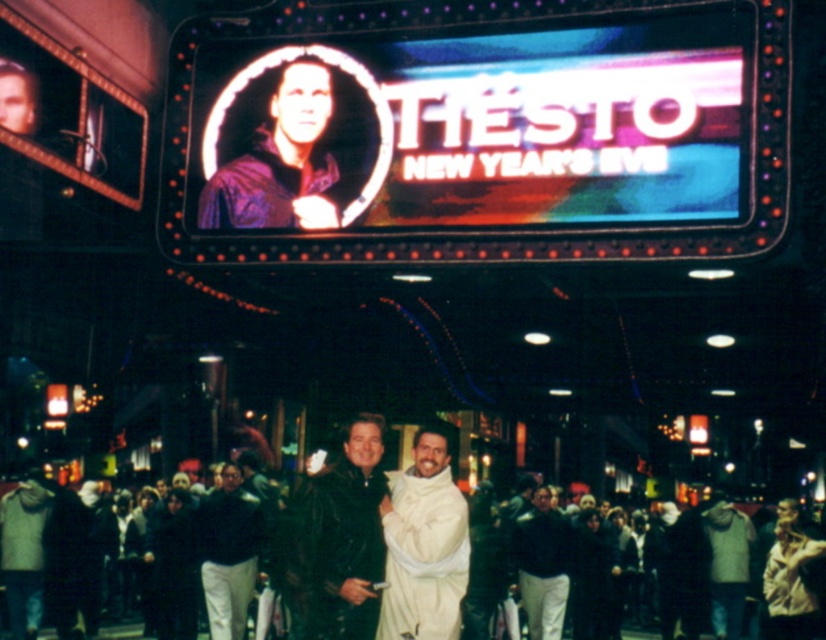
What do you see at coordinates (279, 161) in the screenshot? The height and width of the screenshot is (640, 826). I see `shiny purple jacket at upper center` at bounding box center [279, 161].

Between shiny purple jacket at upper center and dark blue jacket at center, which one is positioned lower?

dark blue jacket at center is below.

At what (x,y) coordinates should I click in order to perform the action: click on shiny purple jacket at upper center. Please return your answer as a coordinate pair (x, y). The height and width of the screenshot is (640, 826). Looking at the image, I should click on (279, 161).

Identify the location of shiny purple jacket at upper center. Image resolution: width=826 pixels, height=640 pixels. (279, 161).

Who is shorter, velvet black coat at center or white matte robe at center?

white matte robe at center

The image size is (826, 640). In order to click on velvet black coat at center in this screenshot , I will do `click(336, 540)`.

Between point (355, 545) and point (440, 552), which one is positioned behind?

Positioned behind is point (355, 545).

This screenshot has height=640, width=826. Identify the location of velvet black coat at center. (336, 540).

Is dark gray fabric jacket at center to the right of dark blue jacket at center from the viewer's perspective?

No, dark gray fabric jacket at center is not to the right of dark blue jacket at center.

Which is behind, point (235, 481) or point (553, 529)?

Point (235, 481)

At what (x,y) coordinates should I click in order to perform the action: click on dark gray fabric jacket at center. Please return your answer as a coordinate pair (x, y). This screenshot has height=640, width=826. Looking at the image, I should click on (228, 552).